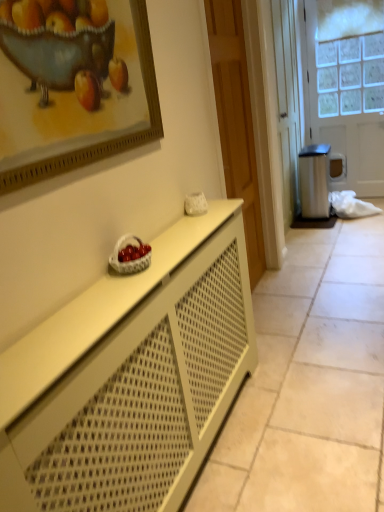
Question: Should I look upward or downward to see wooden door at center, marked as the second door in a back-to-front arrangement?

Choices:
 (A) up
 (B) down

Answer: (A)

Question: Is white matte cabinet at center behind wooden framed painting at upper left?

Choices:
 (A) yes
 (B) no

Answer: (B)

Question: From the image's perspective, is white matte cabinet at center over wooden framed painting at upper left?

Choices:
 (A) yes
 (B) no

Answer: (B)

Question: Can you confirm if white matte cabinet at center is smaller than wooden framed painting at upper left?

Choices:
 (A) yes
 (B) no

Answer: (B)

Question: Can you confirm if white matte cabinet at center is wider than wooden framed painting at upper left?

Choices:
 (A) no
 (B) yes

Answer: (B)

Question: Is white matte cabinet at center taller than wooden framed painting at upper left?

Choices:
 (A) no
 (B) yes

Answer: (B)

Question: Is there a large distance between white matte cabinet at center and wooden framed painting at upper left?

Choices:
 (A) no
 (B) yes

Answer: (A)

Question: Considering the relative positions of wooden door at center, which is the 1th door from front to back, and white wicker basket at center in the image provided, is wooden door at center, which is the 1th door from front to back, in front of white wicker basket at center?

Choices:
 (A) yes
 (B) no

Answer: (B)

Question: Is wooden door at center, marked as the second door in a back-to-front arrangement, in contact with white wicker basket at center?

Choices:
 (A) yes
 (B) no

Answer: (B)

Question: Considering the relative sizes of wooden door at center, marked as the second door in a back-to-front arrangement, and white wicker basket at center in the image provided, is wooden door at center, marked as the second door in a back-to-front arrangement, thinner than white wicker basket at center?

Choices:
 (A) yes
 (B) no

Answer: (B)

Question: Considering the relative sizes of wooden door at center, which is the 1th door from front to back, and white wicker basket at center in the image provided, is wooden door at center, which is the 1th door from front to back, bigger than white wicker basket at center?

Choices:
 (A) yes
 (B) no

Answer: (A)

Question: Considering the relative sizes of wooden door at center, marked as the second door in a back-to-front arrangement, and white wicker basket at center in the image provided, is wooden door at center, marked as the second door in a back-to-front arrangement, wider than white wicker basket at center?

Choices:
 (A) no
 (B) yes

Answer: (B)

Question: From the image's perspective, is wooden door at center, the second door in the right-to-left sequence, under white wicker basket at center?

Choices:
 (A) no
 (B) yes

Answer: (A)

Question: Is white matte cabinet at center further to the viewer compared to white wicker basket at center?

Choices:
 (A) no
 (B) yes

Answer: (A)